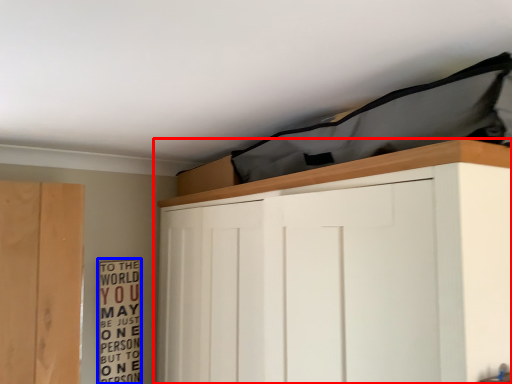
Question: Among these objects, which one is nearest to the camera, cupboard (highlighted by a red box) or bulletin board (highlighted by a blue box)?

Choices:
 (A) cupboard
 (B) bulletin board

Answer: (A)